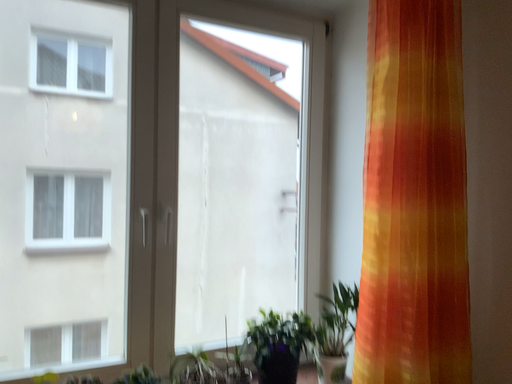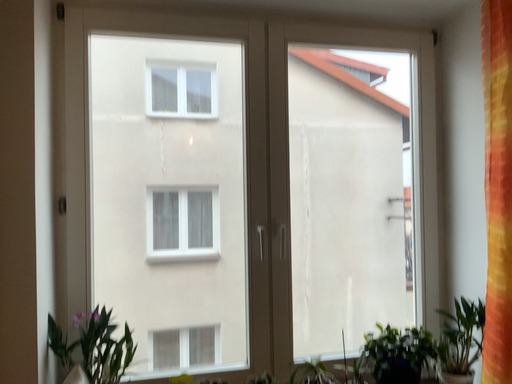
Question: Which way did the camera rotate in the video?

Choices:
 (A) rotated right
 (B) rotated left

Answer: (B)